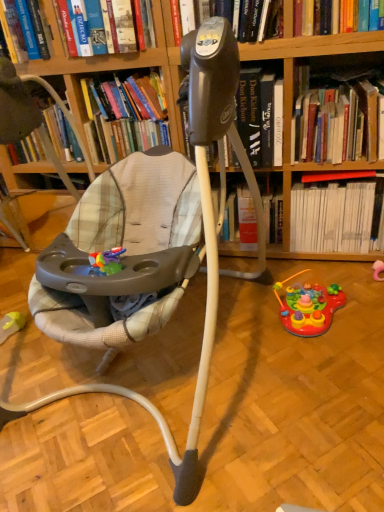
Question: Is black plastic tripod at center facing towards hardcover book at upper center, which appears as the fourth book when viewed from the right?

Choices:
 (A) no
 (B) yes

Answer: (A)

Question: Does black plastic tripod at center lie behind hardcover book at upper center, which is counted as the first book, starting from the left?

Choices:
 (A) no
 (B) yes

Answer: (B)

Question: Considering the relative positions of black plastic tripod at center and hardcover book at upper center, which is counted as the first book, starting from the left, in the image provided, is black plastic tripod at center to the left of hardcover book at upper center, which is counted as the first book, starting from the left, from the viewer's perspective?

Choices:
 (A) yes
 (B) no

Answer: (B)

Question: Can you confirm if black plastic tripod at center is shorter than hardcover book at upper center, which is counted as the first book, starting from the left?

Choices:
 (A) no
 (B) yes

Answer: (A)

Question: Does black plastic tripod at center appear on the right side of hardcover book at upper center, which appears as the fourth book when viewed from the right?

Choices:
 (A) no
 (B) yes

Answer: (B)

Question: Does black plastic tripod at center have a greater width compared to hardcover book at upper center, which is counted as the first book, starting from the left?

Choices:
 (A) no
 (B) yes

Answer: (B)

Question: Considering the relative sizes of plush fabric baby carriage at center and red cardboard book at upper right, which appears as the first book when viewed from the right, in the image provided, is plush fabric baby carriage at center wider than red cardboard book at upper right, which appears as the first book when viewed from the right,?

Choices:
 (A) yes
 (B) no

Answer: (A)

Question: Is plush fabric baby carriage at center far from red cardboard book at upper right, which is the fourth book from left to right?

Choices:
 (A) no
 (B) yes

Answer: (A)

Question: Is red cardboard book at upper right, which appears as the first book when viewed from the right, completely or partially inside plush fabric baby carriage at center?

Choices:
 (A) no
 (B) yes

Answer: (A)

Question: Does plush fabric baby carriage at center have a lesser height compared to red cardboard book at upper right, which is the fourth book from left to right?

Choices:
 (A) yes
 (B) no

Answer: (B)

Question: From a real-world perspective, is plush fabric baby carriage at center beneath red cardboard book at upper right, which appears as the first book when viewed from the right?

Choices:
 (A) yes
 (B) no

Answer: (B)

Question: Does plush fabric baby carriage at center have a greater height compared to red cardboard book at upper right, which appears as the first book when viewed from the right?

Choices:
 (A) yes
 (B) no

Answer: (A)

Question: From a real-world perspective, is hardcover book at upper center, which appears as the fourth book when viewed from the right, located higher than black plastic tripod at center?

Choices:
 (A) no
 (B) yes

Answer: (B)